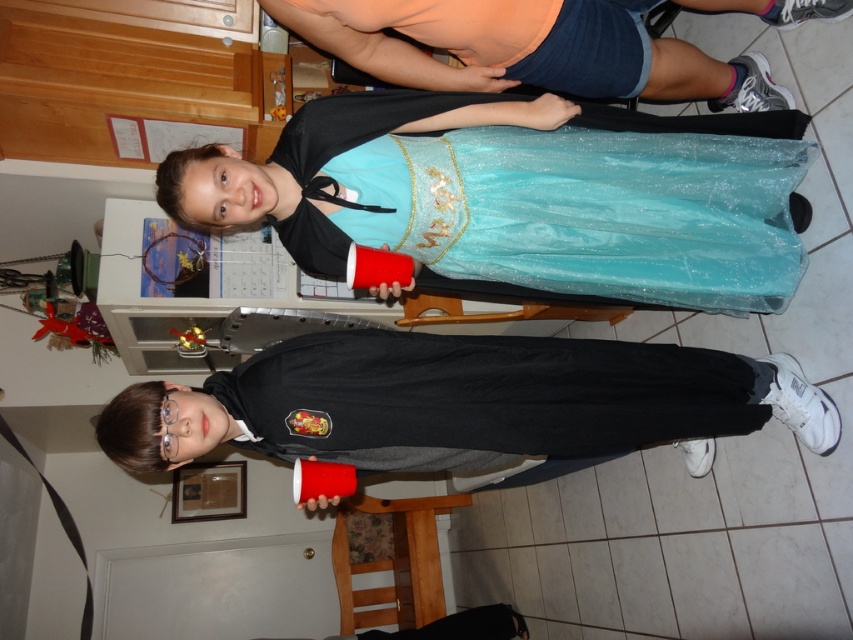
Based on the photo, you are organizing a closet and need to place the matte black hoodie at lower center and the matte orange shorts at upper center. According to their positions in the image, which clothing item should you place on the left side of the closet shelf?

The matte black hoodie at lower center should be placed on the left side of the closet shelf because it is positioned to the left of the matte orange shorts at upper center in the image.

You are a delivery robot with a height of 1.5 meters. You need to pick up the matte black hoodie at lower center which is on a table. Can you reach it without any assistance?

The matte black hoodie at lower center is 1.19 meters away from the camera. Since the robot is 1.5 meters tall, it can likely reach the hoodie if the table height is within its reach range, but the exact table height isn

Based on the photo, you are organizing a clothing donation drive and need to determine which item takes up more space in the donation box. Based on the scene, which item is wider between the matte orange shorts at upper center and the shiny teal dress at center?

The shiny teal dress at center is wider than the matte orange shorts at upper center, so it takes up more space in the donation box.